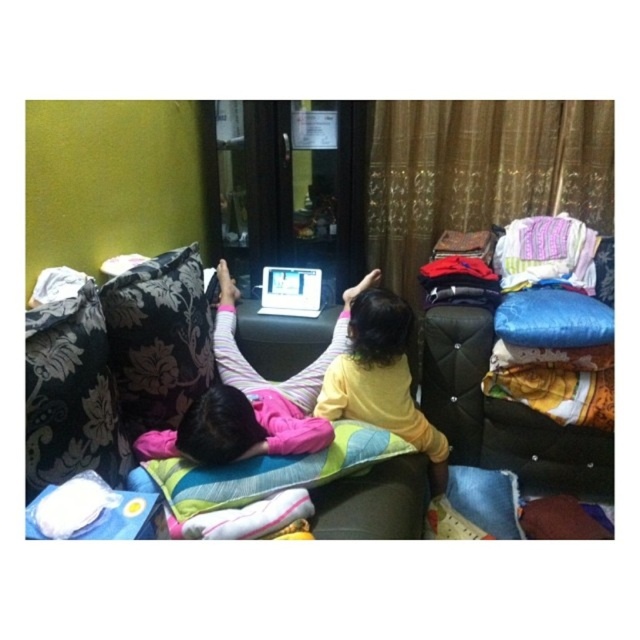
You are standing in the room and want to sit down on the floral fabric couch at center. Which direction should you move relative to the pink fleece pants at center?

To sit on the floral fabric couch at center, you should move to the right side of the pink fleece pants at center since the floral fabric couch at center is positioned on the right side of it.

You are standing in the room and want to place a small table exactly at the center of the room. The floral fabric couch at center is located at coordinates 0.623 on the x axis and 0.394 on the y axis. Is the couch positioned closer to the left or right side of the room?

The floral fabric couch at center is located at coordinates 0.623 on the x axis and 0.394 on the y axis. Since the x coordinate is 0.623, which is closer to 1.0, the couch is positioned closer to the right side of the room.